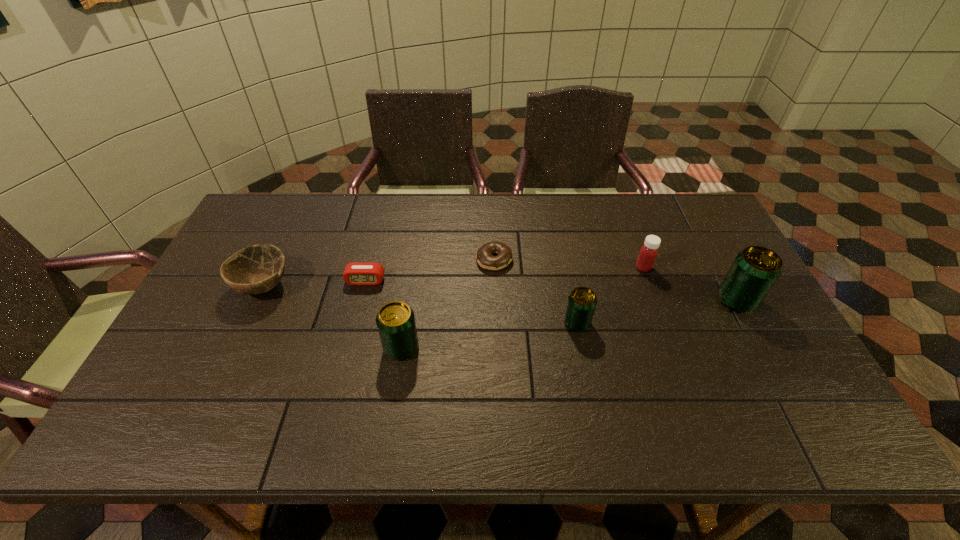
The width and height of the screenshot is (960, 540). Find the location of `the second shortest object`. the second shortest object is located at coordinates (357, 273).

Where is `alarm clock`? alarm clock is located at coordinates (357, 273).

Locate an element on the screen. The image size is (960, 540). the second object from right to left is located at coordinates (648, 253).

Locate an element on the screen. The width and height of the screenshot is (960, 540). vacant region located on the right of the sixth shortest object is located at coordinates (513, 347).

In order to click on free location located on the left of the second beer can from right to left in this screenshot , I will do `click(519, 323)`.

Locate an element on the screen. The height and width of the screenshot is (540, 960). free location located 0.100m on the front of the rightmost object is located at coordinates (760, 346).

This screenshot has width=960, height=540. I want to click on vacant region located 0.200m on the right of the third shortest object, so click(x=361, y=286).

Find the location of a particular element. This screenshot has height=540, width=960. vacant space positioned 0.380m on the left of the doughnut is located at coordinates pyautogui.click(x=353, y=260).

Where is `vacant space located on the front-facing side of the sixth tallest object`? The width and height of the screenshot is (960, 540). vacant space located on the front-facing side of the sixth tallest object is located at coordinates (348, 352).

Locate an element on the screen. Image resolution: width=960 pixels, height=540 pixels. free region located 0.190m on the front of the medicine is located at coordinates (663, 323).